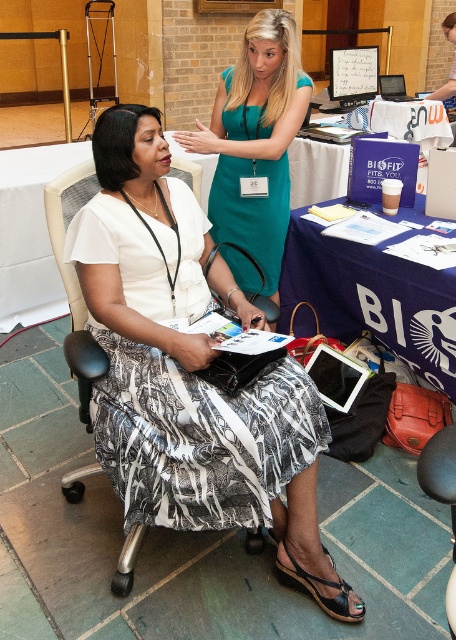
Question: Which of the following is the farthest from the observer?

Choices:
 (A) (374, 324)
 (B) (139, 540)
 (C) (264, 236)

Answer: (C)

Question: Can you confirm if teal satin dress at upper center is smaller than black fabric chair at left?

Choices:
 (A) no
 (B) yes

Answer: (A)

Question: Which object is closer to the camera taking this photo?

Choices:
 (A) white matte tablet at center
 (B) teal satin dress at upper center
 (C) black fabric chair at left

Answer: (C)

Question: Which object is the closest to the black fabric chair at left?

Choices:
 (A) teal satin dress at upper center
 (B) white matte tablet at center

Answer: (A)

Question: Can you confirm if white matte tablet at center is positioned to the right of black fabric chair at left?

Choices:
 (A) yes
 (B) no

Answer: (A)

Question: Is white matte tablet at center below teal satin dress at upper center?

Choices:
 (A) no
 (B) yes

Answer: (B)